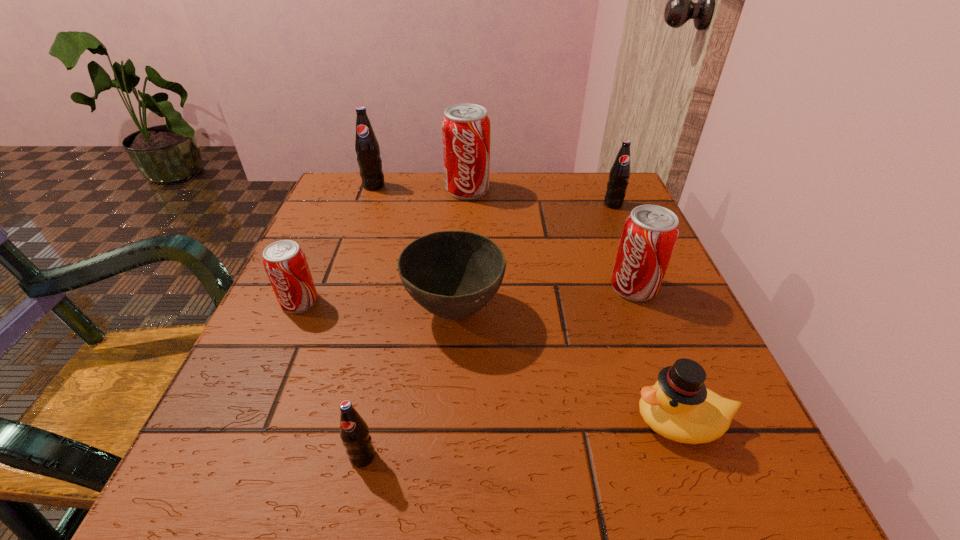
Identify the location of blank space at the far left corner. (362, 196).

The height and width of the screenshot is (540, 960). Identify the location of free region at the near left corner. (255, 446).

Find the location of a particular element. This screenshot has height=540, width=960. vacant area at the far right corner is located at coordinates (591, 191).

Find the location of a particular element. vacant space at the near right corner of the desktop is located at coordinates pyautogui.click(x=707, y=508).

Find the location of `unoccupied position between the yellow duck and the rightmost red soda can`. unoccupied position between the yellow duck and the rightmost red soda can is located at coordinates (658, 354).

Locate an element on the screen. Image resolution: width=960 pixels, height=540 pixels. empty space that is in between the smallest red soda can and the brown bowl is located at coordinates (377, 307).

Where is `vacant area that lies between the second nearest black pop and the brown bowl`? The image size is (960, 540). vacant area that lies between the second nearest black pop and the brown bowl is located at coordinates (534, 258).

I want to click on free point between the leftmost black pop and the duck, so click(527, 303).

You are a GUI agent. You are given a task and a screenshot of the screen. Output one action in this format:
    pyautogui.click(x=<x>, y=<y>)
    Task: Click on the free space between the biggest black pop and the smallest red soda can
    The image size is (960, 540).
    Given the screenshot: What is the action you would take?
    pyautogui.click(x=337, y=244)

Locate an element on the screen. vacant area that lies between the farthest black pop and the second red soda can from left to right is located at coordinates (420, 187).